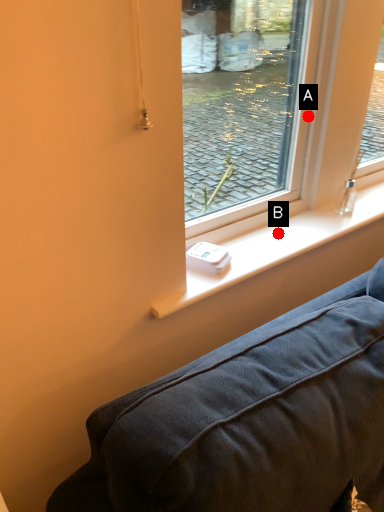
Question: Two points are circled on the image, labeled by A and B beside each circle. Which point is farther to the camera?

Choices:
 (A) A is further
 (B) B is further

Answer: (B)